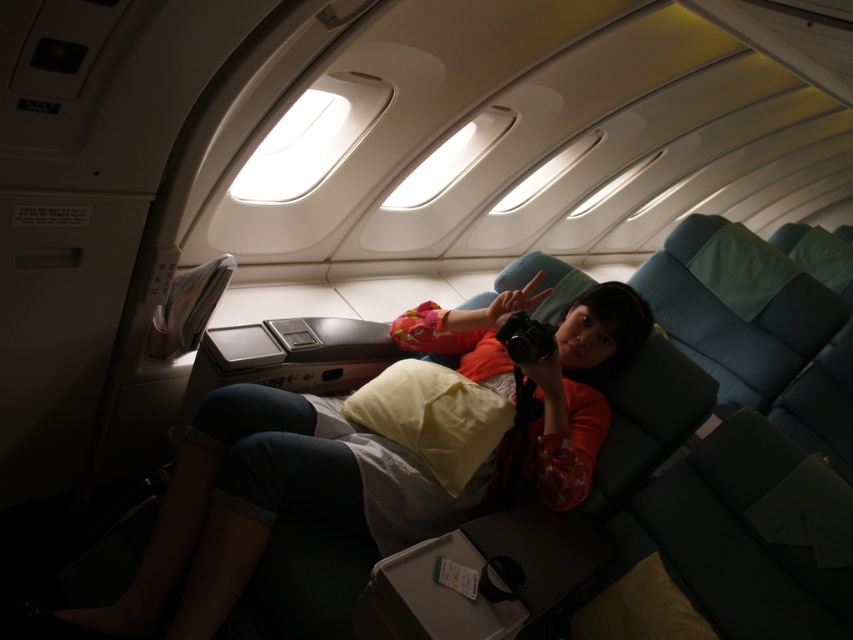
You are a flight attendant checking the seating area. You notice the matte orange shirt at center and the yellow soft pillow at center. Are these two items close enough to each other that a passenger could easily reach both without moving their arms too much?

The matte orange shirt at center and the yellow soft pillow at center are 5.54 inches apart from each other. Since this distance is relatively short, a passenger could easily reach both items without needing to move their arms excessively.

You are a flight attendant checking the seating area. You notice the matte orange shirt at center and the yellow soft pillow at center. Which object takes up more space in the seat area?

The matte orange shirt at center is larger in size than the yellow soft pillow at center, so it takes up more space in the seat area.